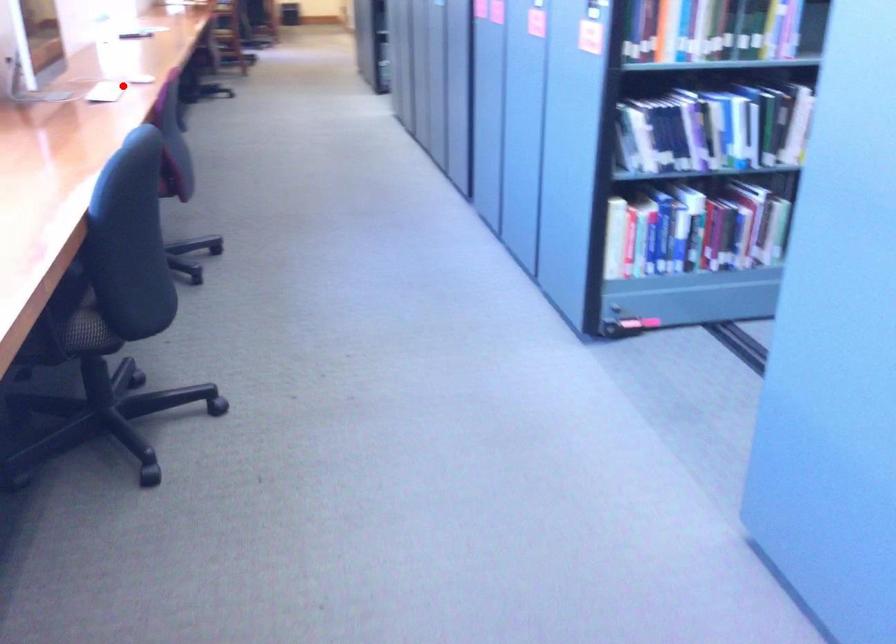
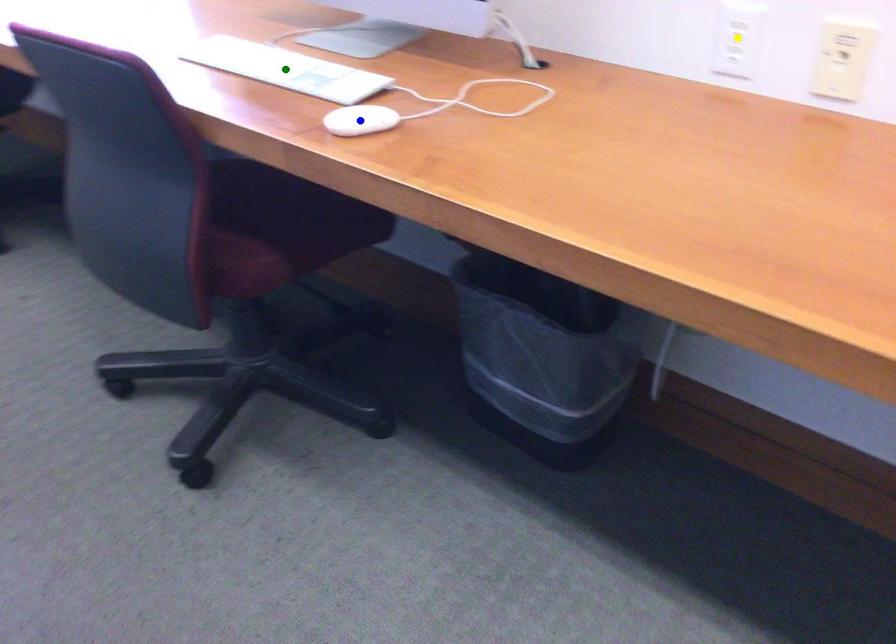
Question: I am providing you with two images of the same scene from different viewpoints. A red point is marked on the first image. You are given multiple points on the second image. Which point in image 2 is actually the same real-world point as the red point in image 1?

Choices:
 (A) yellow point
 (B) blue point
 (C) green point

Answer: (C)